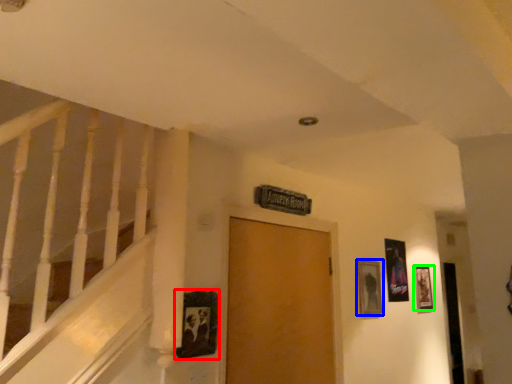
Question: Which object is positioned farthest from picture frame (highlighted by a red box)? Select from picture frame (highlighted by a blue box) and picture frame (highlighted by a green box).

Choices:
 (A) picture frame
 (B) picture frame

Answer: (B)